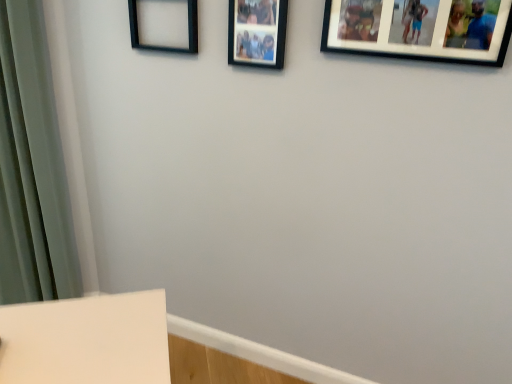
Question: Would you say black matte picture frame at upper center, the 2th picture frame from the right, is to the left or to the right of black matte picture frame at upper right, the third picture frame in the left-to-right sequence, in the picture?

Choices:
 (A) right
 (B) left

Answer: (B)

Question: From the image's perspective, is black matte picture frame at upper center, the 2th picture frame from the right, located above or below black matte picture frame at upper right, the first picture frame when ordered from right to left?

Choices:
 (A) below
 (B) above

Answer: (B)

Question: Which is farther from the black matte picture frame at upper left, acting as the first picture frame starting from the left?

Choices:
 (A) black matte picture frame at upper right, the third picture frame in the left-to-right sequence
 (B) black matte picture frame at upper center, the 2th picture frame from the right

Answer: (A)

Question: Estimate the real-world distances between objects in this image. Which object is farther from the black matte picture frame at upper center, the second picture frame from the left?

Choices:
 (A) black matte picture frame at upper right, the first picture frame when ordered from right to left
 (B) black matte picture frame at upper left, acting as the first picture frame starting from the left

Answer: (A)